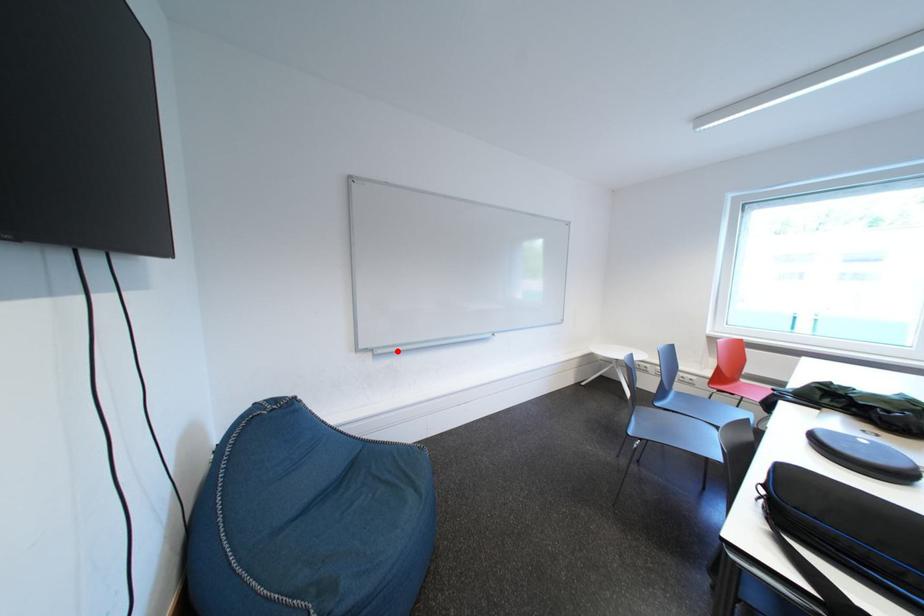
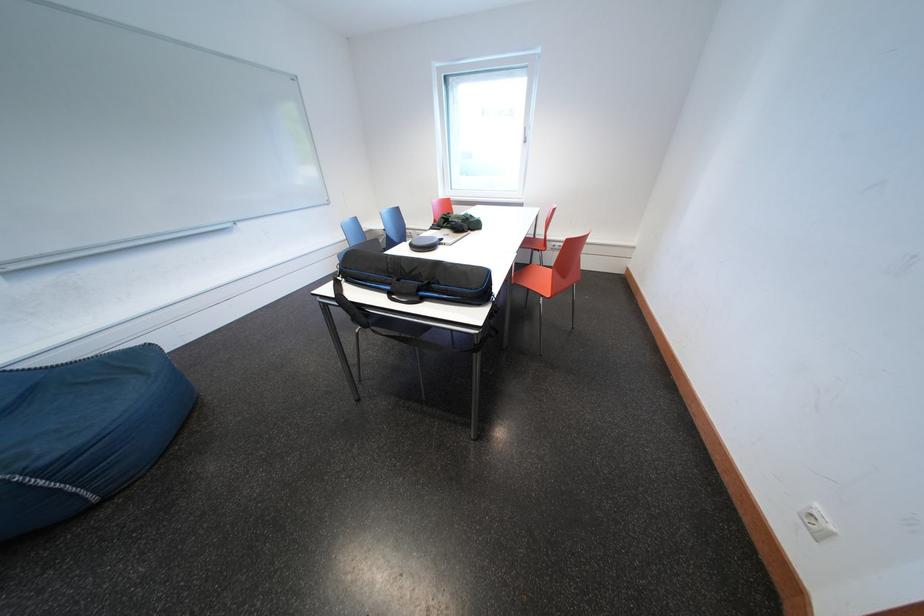
Locate, in the second image, the point that corresponds to the highlighted location in the first image.

(39, 262)